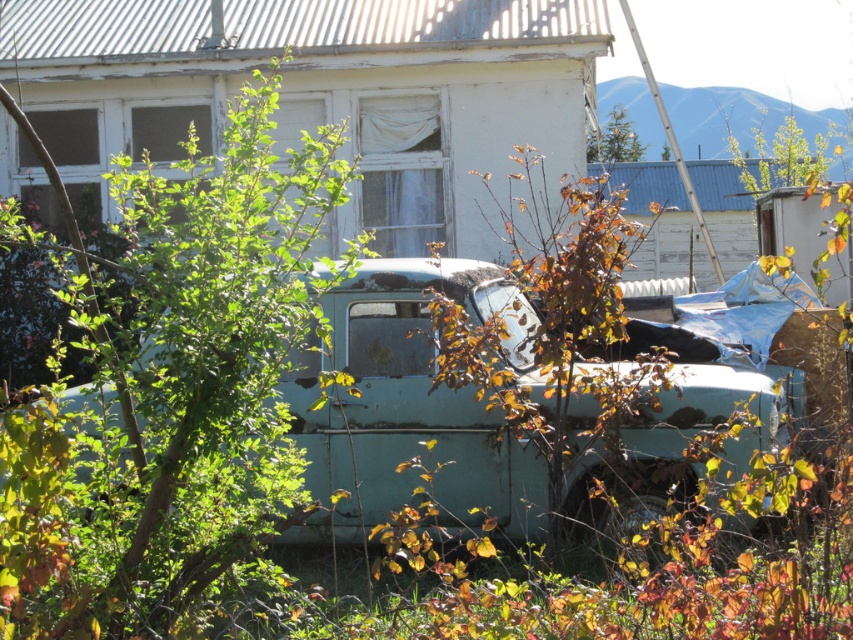
Question: Which object appears closest to the camera in this image?

Choices:
 (A) green leafy tree at upper center
 (B) light blue matte car at center
 (C) green leafy tree at center
 (D) teal matte pickup truck at center

Answer: (C)

Question: Is green leafy tree at center to the right of green leafy tree at upper center from the viewer's perspective?

Choices:
 (A) no
 (B) yes

Answer: (A)

Question: Can you confirm if green leafy tree at center is thinner than light blue matte car at center?

Choices:
 (A) no
 (B) yes

Answer: (B)

Question: Can you confirm if green leafy tree at center is positioned below green leafy tree at upper center?

Choices:
 (A) yes
 (B) no

Answer: (A)

Question: Which point is farther from the camera taking this photo?

Choices:
 (A) (613, 131)
 (B) (282, 538)
 (C) (213, 433)

Answer: (A)

Question: Which point is closer to the camera?

Choices:
 (A) teal matte pickup truck at center
 (B) light blue matte car at center
 (C) green leafy tree at center
 (D) green leafy tree at upper center

Answer: (C)